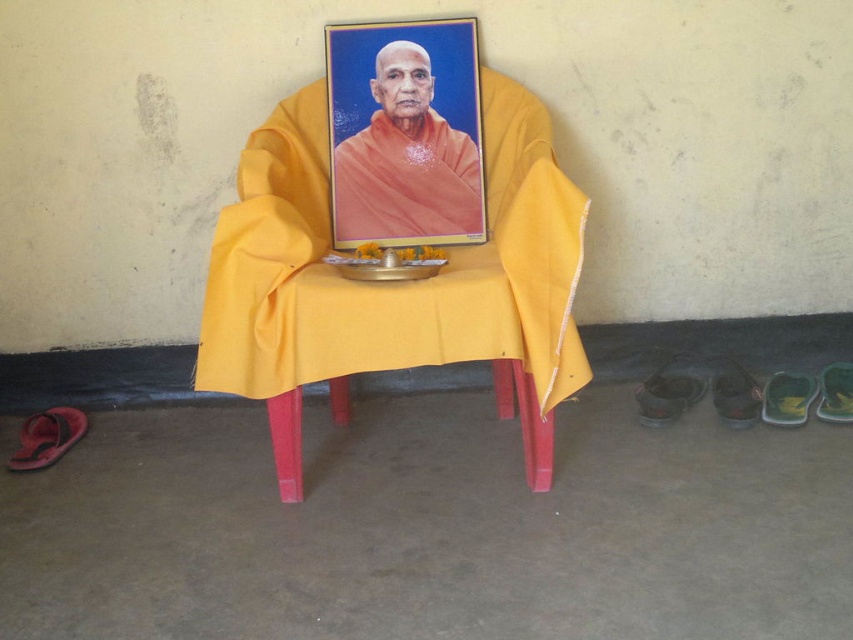
Question: Which of the following is the farthest from the observer?

Choices:
 (A) (393, 125)
 (B) (308, 195)

Answer: (A)

Question: From the image, what is the correct spatial relationship of yellow fabric-covered chair at center in relation to orange clothed monk at center?

Choices:
 (A) left
 (B) right

Answer: (B)

Question: Which point is closer to the camera taking this photo?

Choices:
 (A) (415, 51)
 (B) (454, 252)

Answer: (A)

Question: Can you confirm if yellow fabric-covered chair at center is positioned below orange clothed monk at center?

Choices:
 (A) no
 (B) yes

Answer: (B)

Question: Is yellow fabric-covered chair at center positioned at the back of orange clothed monk at center?

Choices:
 (A) yes
 (B) no

Answer: (B)